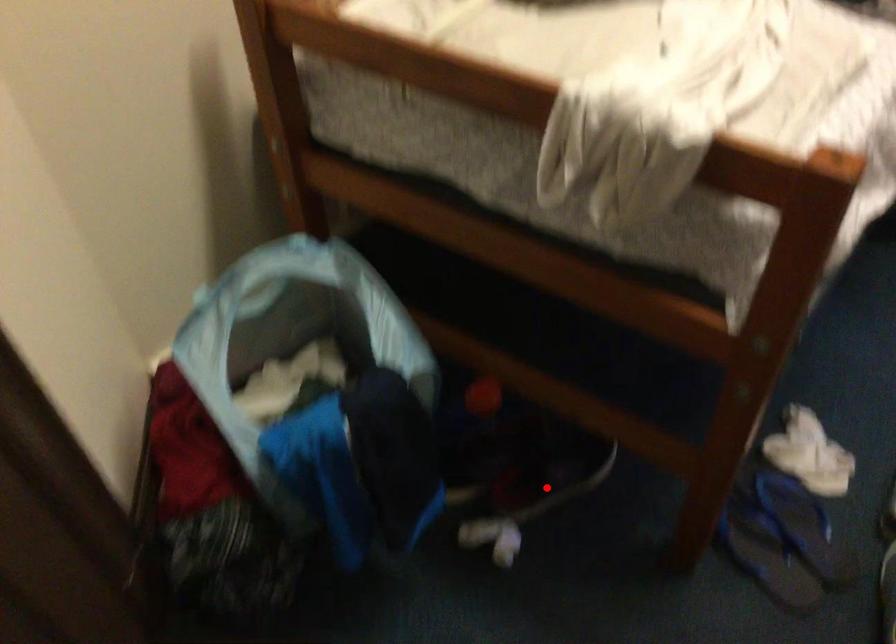
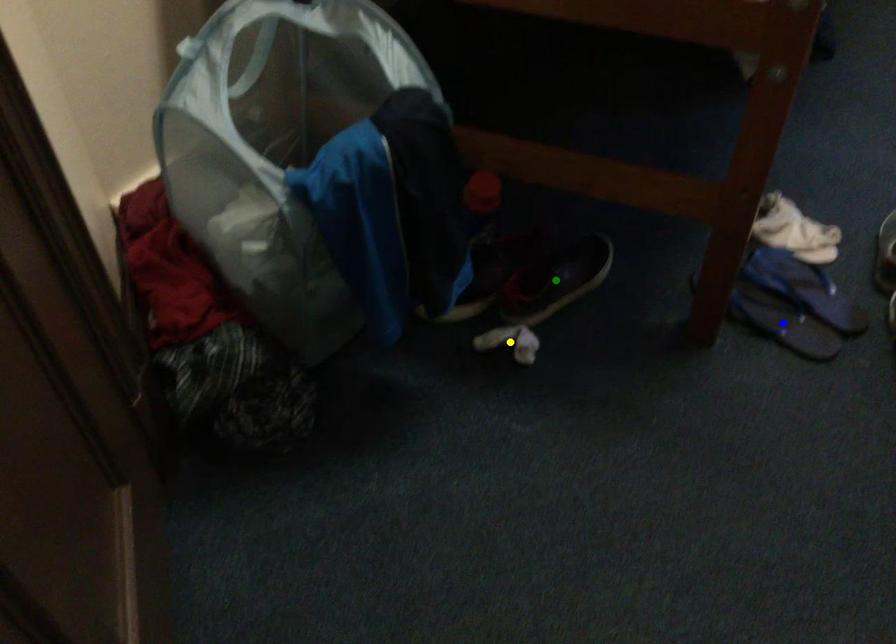
Question: I am providing you with two images of the same scene from different viewpoints. A red point is marked on the first image. You are given multiple points on the second image. Which point in image 2 represents the same 3d spot as the red point in image 1?

Choices:
 (A) yellow point
 (B) green point
 (C) blue point

Answer: (B)